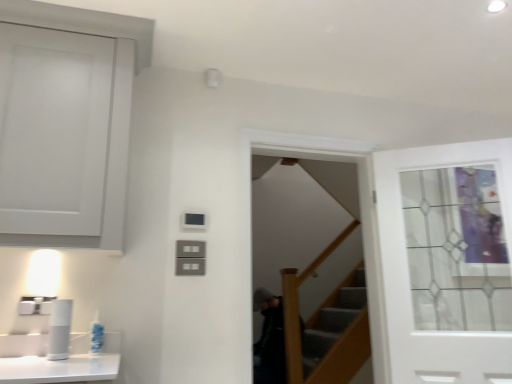
Question: From their relative heights in the image, would you say white plastic toothbrush at lower left is taller or shorter than white glass door at upper right?

Choices:
 (A) tall
 (B) short

Answer: (B)

Question: Is point 100,337 positioned closer to the camera than point 374,165?

Choices:
 (A) closer
 (B) farther

Answer: (A)

Question: Which of these objects is positioned farthest from the clear glass screen door at center?

Choices:
 (A) white plastic toothbrush at lower left
 (B) white glass door at upper right

Answer: (A)

Question: Based on their relative distances, which object is nearer to the clear glass screen door at center?

Choices:
 (A) white glass door at upper right
 (B) white plastic toothbrush at lower left

Answer: (A)